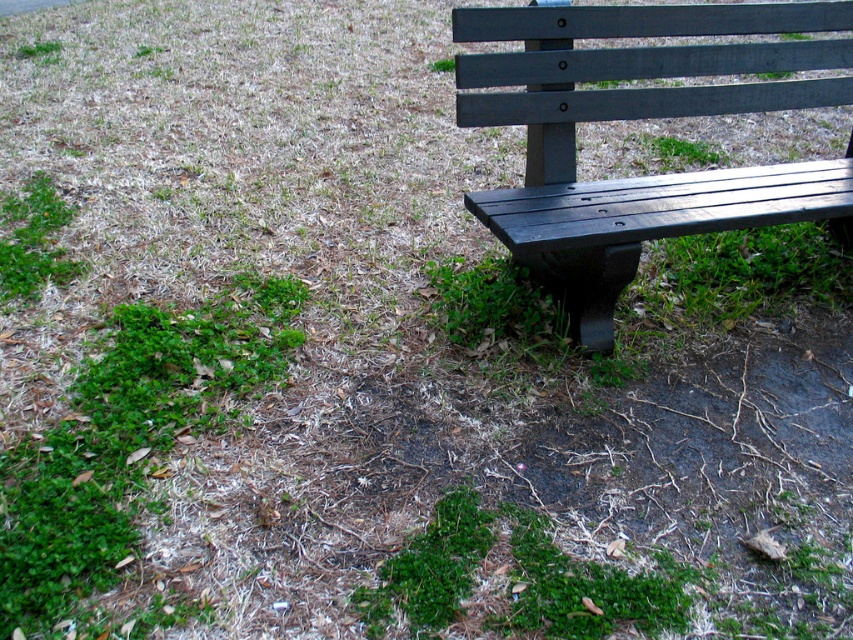
Find the location of a particular element. The height and width of the screenshot is (640, 853). matte black bench at right is located at coordinates (637, 118).

Which of these two, matte black bench at right or green leafy grass at lower left, stands taller?

matte black bench at right is taller.

Identify the location of matte black bench at right. (637, 118).